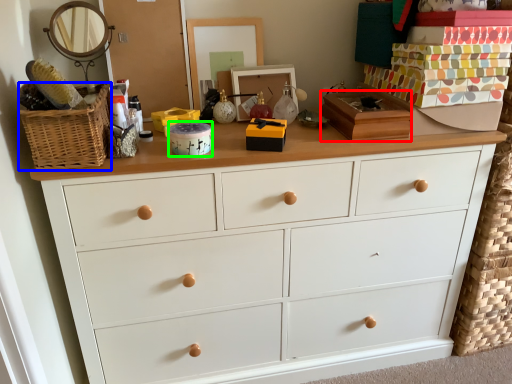
Question: Which object is positioned farthest from box (highlighted by a red box)? Select from basket (highlighted by a blue box) and box (highlighted by a green box).

Choices:
 (A) basket
 (B) box

Answer: (A)